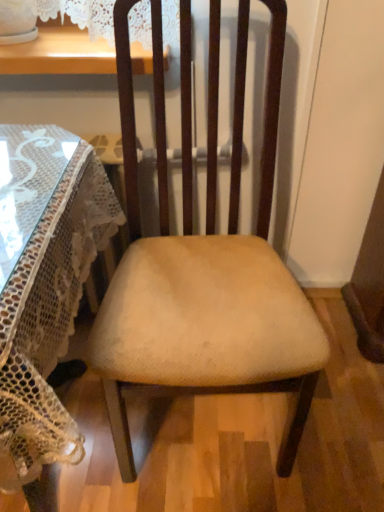
What do you see at coordinates (44, 286) in the screenshot?
I see `transparent glass table at left` at bounding box center [44, 286].

Identify the location of transparent glass table at left. Image resolution: width=384 pixels, height=512 pixels. (44, 286).

Describe the element at coordinates (204, 259) in the screenshot. I see `beige fabric chair at center` at that location.

Where is `beige fabric chair at center`? Image resolution: width=384 pixels, height=512 pixels. beige fabric chair at center is located at coordinates (204, 259).

Find the location of a particular element. transparent glass table at left is located at coordinates (44, 286).

Considering the relative positions of transparent glass table at left and beige fabric chair at center in the image provided, is transparent glass table at left to the right of beige fabric chair at center from the viewer's perspective?

No, transparent glass table at left is not to the right of beige fabric chair at center.

Is the position of transparent glass table at left more distant than that of beige fabric chair at center?

No, it is not.

Does point (41, 443) come in front of point (135, 341)?

Yes, point (41, 443) is in front of point (135, 341).

From the image's perspective, is transparent glass table at left above beige fabric chair at center?

No, from the image's perspective, transparent glass table at left is not over beige fabric chair at center.

From a real-world perspective, is transparent glass table at left physically located above or below beige fabric chair at center?

Clearly, from a real-world perspective, transparent glass table at left is below beige fabric chair at center.

Which object is wider, transparent glass table at left or beige fabric chair at center?

Wider between the two is transparent glass table at left.

Which of these two, transparent glass table at left or beige fabric chair at center, stands shorter?

transparent glass table at left.

In terms of size, does transparent glass table at left appear bigger or smaller than beige fabric chair at center?

Clearly, transparent glass table at left is larger in size than beige fabric chair at center.

Is transparent glass table at left completely or partially outside of beige fabric chair at center?

Yes, transparent glass table at left is outside of beige fabric chair at center.

Is transparent glass table at left directly adjacent to beige fabric chair at center?

No, transparent glass table at left is not in contact with beige fabric chair at center.

Consider the image. Is transparent glass table at left turned away from beige fabric chair at center?

transparent glass table at left is not turned away from beige fabric chair at center.

How many degrees apart are the facing directions of transparent glass table at left and beige fabric chair at center?

3.4 degrees separate the facing orientations of transparent glass table at left and beige fabric chair at center.

How distant is transparent glass table at left from beige fabric chair at center?

The distance of transparent glass table at left from beige fabric chair at center is 9.35 inches.

In the image, there is a transparent glass table at left. Where is `chair above it (from the image's perspective)`? The image size is (384, 512). chair above it (from the image's perspective) is located at coordinates (204, 259).

Considering the positions of objects beige fabric chair at center and transparent glass table at left in the image provided, who is more to the left, beige fabric chair at center or transparent glass table at left?

From the viewer's perspective, transparent glass table at left appears more on the left side.

Who is more distant, beige fabric chair at center or transparent glass table at left?

Positioned behind is beige fabric chair at center.

Which point is more forward, (315, 324) or (92, 189)?

The point (315, 324) is in front.

From the image's perspective, does beige fabric chair at center appear lower than transparent glass table at left?

No, from the image's perspective, beige fabric chair at center is not beneath transparent glass table at left.

From the picture: From a real-world perspective, is beige fabric chair at center physically located above or below transparent glass table at left?

beige fabric chair at center is situated higher than transparent glass table at left in the real world.

Considering the sizes of objects beige fabric chair at center and transparent glass table at left in the image provided, who is thinner, beige fabric chair at center or transparent glass table at left?

Thinner between the two is beige fabric chair at center.

Considering the sizes of beige fabric chair at center and transparent glass table at left in the image, is beige fabric chair at center taller or shorter than transparent glass table at left?

beige fabric chair at center is taller than transparent glass table at left.

Is beige fabric chair at center bigger than transparent glass table at left?

Actually, beige fabric chair at center might be smaller than transparent glass table at left.

Can we say beige fabric chair at center lies outside transparent glass table at left?

That's correct, beige fabric chair at center is outside of transparent glass table at left.

Is beige fabric chair at center placed right next to transparent glass table at left?

beige fabric chair at center and transparent glass table at left are clearly separated.

Is beige fabric chair at center facing away from transparent glass table at left?

No, transparent glass table at left is not at the back of beige fabric chair at center.

How different are the orientations of beige fabric chair at center and transparent glass table at left in degrees?

The facing directions of beige fabric chair at center and transparent glass table at left are 3.4 degrees apart.

This screenshot has width=384, height=512. I want to click on chair above the transparent glass table at left (from a real-world perspective), so click(204, 259).

Find the location of a particular element. chair above the transparent glass table at left (from the image's perspective) is located at coordinates (204, 259).

You are a GUI agent. You are given a task and a screenshot of the screen. Output one action in this format:
    pyautogui.click(x=<x>, y=<y>)
    Task: Click on the chair above the transparent glass table at left (from a real-world perspective)
    The image size is (384, 512).
    Given the screenshot: What is the action you would take?
    tap(204, 259)